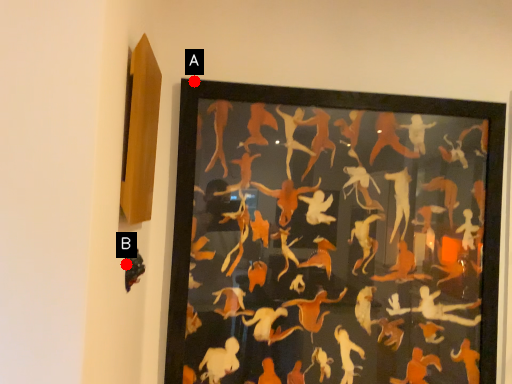
Question: Two points are circled on the image, labeled by A and B beside each circle. Among these points, which one is farthest from the camera?

Choices:
 (A) A is further
 (B) B is further

Answer: (A)